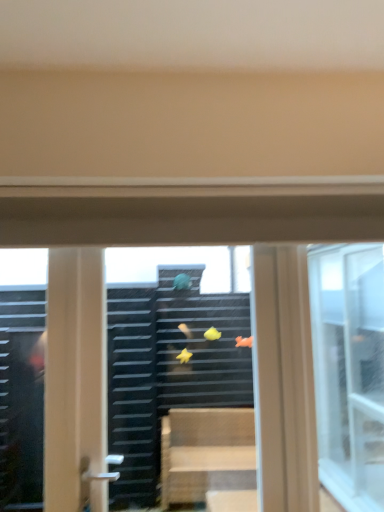
Question: Does transparent glass window at center, the 2th window from the right, have a smaller size compared to transparent glass window at center, which ranks as the 2th window in left-to-right order?

Choices:
 (A) yes
 (B) no

Answer: (B)

Question: Are transparent glass window at center, the 1th window from the left, and transparent glass window at center, acting as the first window starting from the right, making contact?

Choices:
 (A) yes
 (B) no

Answer: (B)

Question: Is transparent glass window at center, the 2th window from the right, oriented away from transparent glass window at center, acting as the first window starting from the right?

Choices:
 (A) yes
 (B) no

Answer: (A)

Question: From a real-world perspective, is transparent glass window at center, the 2th window from the right, physically above transparent glass window at center, acting as the first window starting from the right?

Choices:
 (A) yes
 (B) no

Answer: (B)

Question: Is transparent glass window at center, the 1th window from the left, closer to the viewer compared to transparent glass window at center, acting as the first window starting from the right?

Choices:
 (A) yes
 (B) no

Answer: (A)

Question: Considering the positions of transparent plastic magnets at center and transparent glass window at center, the 2th window from the right, in the image, is transparent plastic magnets at center bigger or smaller than transparent glass window at center, the 2th window from the right,?

Choices:
 (A) big
 (B) small

Answer: (B)

Question: Is point (173, 389) positioned closer to the camera than point (147, 462)?

Choices:
 (A) farther
 (B) closer

Answer: (A)

Question: Considering their positions, is transparent plastic magnets at center located in front of or behind transparent glass window at center, the 2th window from the right?

Choices:
 (A) front
 (B) behind

Answer: (B)

Question: From the image's perspective, is transparent plastic magnets at center located above or below transparent glass window at center, the 1th window from the left?

Choices:
 (A) below
 (B) above

Answer: (B)

Question: Is transparent glass window at center, the 1th window from the left, in front of or behind transparent plastic magnets at center in the image?

Choices:
 (A) behind
 (B) front

Answer: (B)

Question: Is point (127, 420) closer or farther from the camera than point (203, 407)?

Choices:
 (A) closer
 (B) farther

Answer: (A)

Question: From the image's perspective, is transparent glass window at center, the 2th window from the right, positioned above or below transparent plastic magnets at center?

Choices:
 (A) above
 (B) below

Answer: (B)

Question: Looking at their shapes, would you say transparent glass window at center, the 1th window from the left, is wider or thinner than transparent plastic magnets at center?

Choices:
 (A) wide
 (B) thin

Answer: (B)

Question: Is point (316, 283) closer or farther from the camera than point (201, 272)?

Choices:
 (A) closer
 (B) farther

Answer: (A)

Question: Choose the correct answer: Is transparent glass window at center, acting as the first window starting from the right, inside transparent plastic magnets at center or outside it?

Choices:
 (A) inside
 (B) outside

Answer: (B)